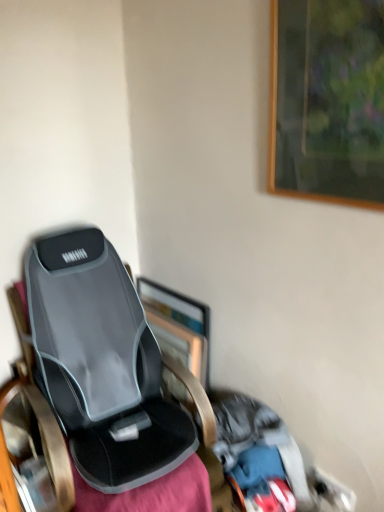
Question: Can you confirm if metallic silver picture frame at center, the first picture frame viewed from the left, is smaller than wooden picture frame at upper right, the 2th picture frame positioned from the bottom?

Choices:
 (A) yes
 (B) no

Answer: (B)

Question: Considering the relative positions of metallic silver picture frame at center, the 2th picture frame in the right-to-left sequence, and wooden picture frame at upper right, which is counted as the 2th picture frame, starting from the left, in the image provided, is metallic silver picture frame at center, the 2th picture frame in the right-to-left sequence, behind wooden picture frame at upper right, which is counted as the 2th picture frame, starting from the left,?

Choices:
 (A) yes
 (B) no

Answer: (A)

Question: Does metallic silver picture frame at center, acting as the second picture frame starting from the top, contain wooden picture frame at upper right, the 1th picture frame from the top?

Choices:
 (A) yes
 (B) no

Answer: (B)

Question: Considering the relative sizes of metallic silver picture frame at center, which is counted as the first picture frame, starting from the bottom, and wooden picture frame at upper right, which is counted as the 2th picture frame, starting from the left, in the image provided, is metallic silver picture frame at center, which is counted as the first picture frame, starting from the bottom, shorter than wooden picture frame at upper right, which is counted as the 2th picture frame, starting from the left,?

Choices:
 (A) yes
 (B) no

Answer: (A)

Question: Can you confirm if metallic silver picture frame at center, which is the first picture frame from back to front, is thinner than wooden picture frame at upper right, the 1th picture frame from the top?

Choices:
 (A) yes
 (B) no

Answer: (B)

Question: Is metallic silver picture frame at center, the 2th picture frame in the right-to-left sequence, facing away from wooden picture frame at upper right, acting as the first picture frame starting from the front?

Choices:
 (A) no
 (B) yes

Answer: (A)

Question: Are wooden picture frame at upper right, the 2th picture frame positioned from the bottom, and metallic silver picture frame at center, which is the first picture frame from back to front, far apart?

Choices:
 (A) no
 (B) yes

Answer: (A)

Question: Does wooden picture frame at upper right, the second picture frame in the back-to-front sequence, have a lesser width compared to metallic silver picture frame at center, the 2th picture frame in the right-to-left sequence?

Choices:
 (A) yes
 (B) no

Answer: (A)

Question: Is wooden picture frame at upper right, the 1th picture frame from the top, to the right of metallic silver picture frame at center, the first picture frame viewed from the left, from the viewer's perspective?

Choices:
 (A) yes
 (B) no

Answer: (A)

Question: From the image's perspective, is wooden picture frame at upper right, which ranks as the 1th picture frame in right-to-left order, over metallic silver picture frame at center, the 2th picture frame in the front-to-back sequence?

Choices:
 (A) yes
 (B) no

Answer: (A)

Question: Is wooden picture frame at upper right, the second picture frame in the back-to-front sequence, taller than metallic silver picture frame at center, acting as the second picture frame starting from the top?

Choices:
 (A) yes
 (B) no

Answer: (A)

Question: Is wooden picture frame at upper right, which is counted as the 2th picture frame, starting from the left, positioned with its back to metallic silver picture frame at center, the first picture frame viewed from the left?

Choices:
 (A) no
 (B) yes

Answer: (A)

Question: Visually, is wooden picture frame at upper right, the second picture frame in the back-to-front sequence, positioned to the left or to the right of metallic silver picture frame at center, the 2th picture frame in the front-to-back sequence?

Choices:
 (A) left
 (B) right

Answer: (B)